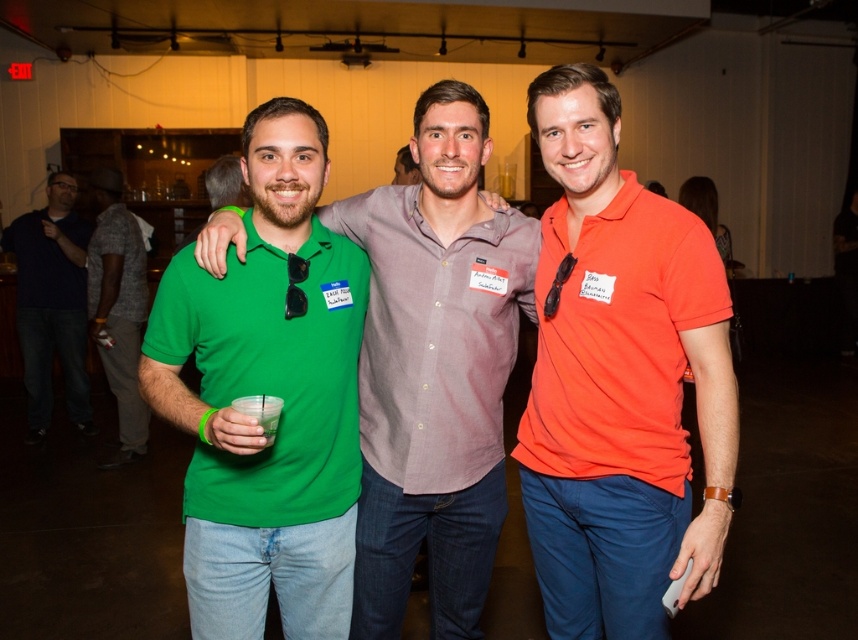
Which is below, orange matte shirt at center or matte black shirt at left?

orange matte shirt at center is lower down.

What do you see at coordinates (618, 380) in the screenshot? The width and height of the screenshot is (858, 640). I see `orange matte shirt at center` at bounding box center [618, 380].

The width and height of the screenshot is (858, 640). I want to click on orange matte shirt at center, so click(x=618, y=380).

Does green matte polo shirt at left have a greater height compared to green matte shirt at center?

Incorrect, green matte polo shirt at left's height is not larger of green matte shirt at center's.

Which of these two, green matte polo shirt at left or green matte shirt at center, stands shorter?

green matte polo shirt at left

Does point (340, 268) come behind point (124, 282)?

That is False.

You are a GUI agent. You are given a task and a screenshot of the screen. Output one action in this format:
    pyautogui.click(x=<x>, y=<y>)
    Task: Click on the green matte polo shirt at left
    This screenshot has height=640, width=858.
    Given the screenshot: What is the action you would take?
    pyautogui.click(x=270, y=372)

Who is positioned more to the left, matte black shirt at left or translucent plastic cup at center?

Positioned to the left is matte black shirt at left.

Locate an element on the screen. This screenshot has width=858, height=640. matte black shirt at left is located at coordinates (52, 304).

Find the location of a particular element. matte black shirt at left is located at coordinates (52, 304).